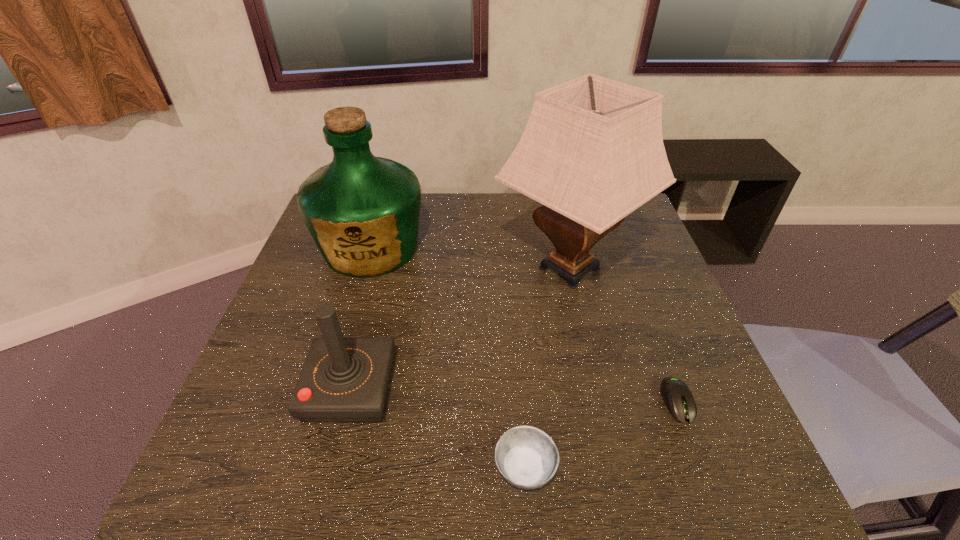
Where is `free spot that satisfies the following two spatial constraints: 1. on the rectangular base of the nearest object; 2. on the right side of the third tallest object`? free spot that satisfies the following two spatial constraints: 1. on the rectangular base of the nearest object; 2. on the right side of the third tallest object is located at coordinates (330, 468).